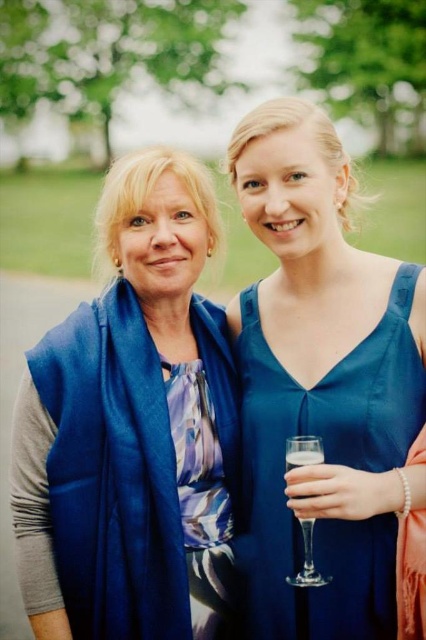
Does point (80, 448) lie behind point (302, 465)?

That is True.

Between point (95, 580) and point (290, 460), which one is positioned behind?

Point (95, 580)

Locate an element on the screen. The image size is (426, 640). blue fabric scarf at left is located at coordinates (132, 428).

Is satin blue dress at right further to the viewer compared to clear glass champagne flute at center?

Yes, it is.

Is satin blue dress at right smaller than clear glass champagne flute at center?

No, satin blue dress at right is not smaller than clear glass champagne flute at center.

This screenshot has width=426, height=640. Find the location of `satin blue dress at right`. satin blue dress at right is located at coordinates (327, 464).

Find the location of a particular element. satin blue dress at right is located at coordinates (327, 464).

Is satin blue dress at right positioned in front of clear glass wine glass at right?

That is False.

Who is more forward, (x=408, y=388) or (x=291, y=452)?

Point (x=291, y=452)

Where is `satin blue dress at right`? The width and height of the screenshot is (426, 640). satin blue dress at right is located at coordinates (327, 464).